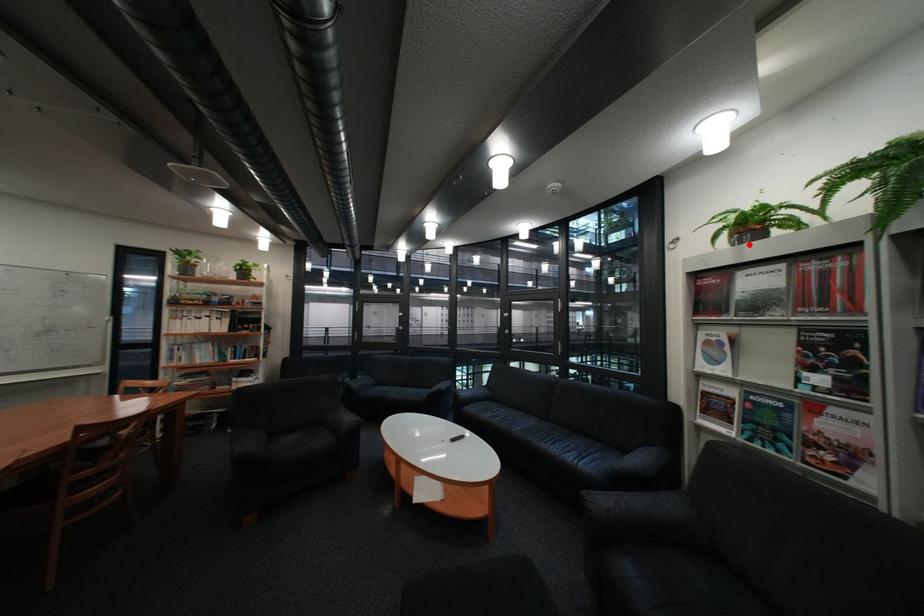
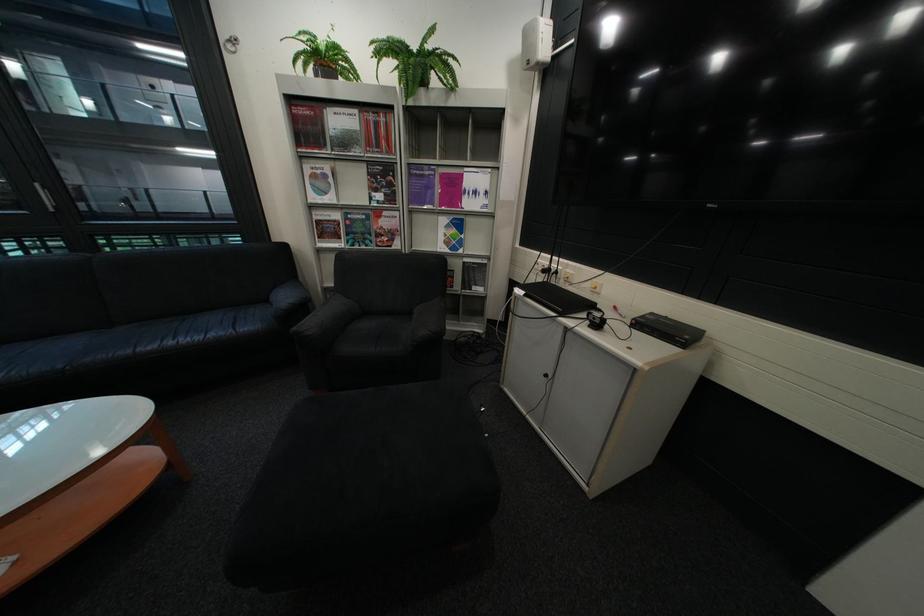
Question: I am providing you with two images of the same scene from different viewpoints. A red point is marked on the first image. Is the red point's position out of view in image 2?

Choices:
 (A) Yes
 (B) No

Answer: (B)